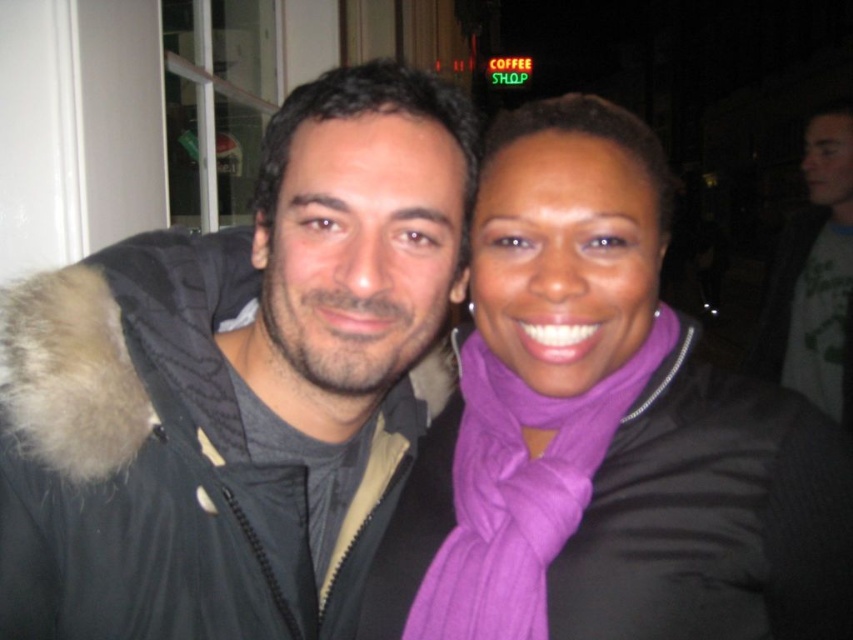
You are a photographer trying to capture a wide shot of the two people wearing the matte black jacket at left and the matte gray jacket at right. Your camera has a maximum focus range of 2 meters. Will you be able to capture both jackets in focus at the same time?

The matte black jacket at left and the matte gray jacket at right are 2.23 meters apart. Since the camera can only focus up to 2 meters, you won that be able to capture both jackets in focus simultaneously.

You are a photographer trying to capture a closeup of the purple soft scarf at center without including the matte black jacket at left in the frame. Is this possible given their positions?

The matte black jacket at left is above the purple soft scarf at center, so if you position your camera to focus on the lower part of the purple soft scarf at center while avoiding the area where the matte black jacket at left is positioned above, it should be possible to capture the closeup without including the jacket.

You are a photographer trying to capture a photo of the matte black jacket at left. Based on its position coordinates, where should you aim your camera?

The matte black jacket at left is located at point coordinates 0.600 on the x axis and 0.281 on the y axis, so aim your camera there.